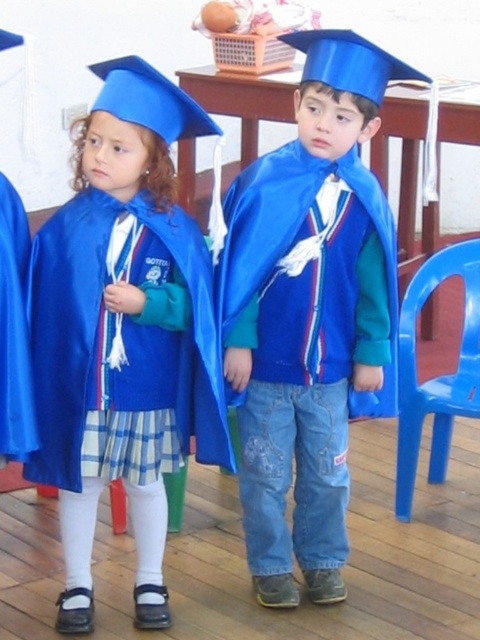
Question: Estimate the real-world distances between objects in this image. Which object is farther from the blue plastic chair at lower right?

Choices:
 (A) shiny blue graduation gown at center
 (B) matte blue graduation gown at center

Answer: (B)

Question: Where is matte blue graduation gown at center located in relation to blue plastic chair at lower right in the image?

Choices:
 (A) above
 (B) below

Answer: (A)

Question: Which point appears closest to the camera in this image?

Choices:
 (A) (336, 42)
 (B) (113, 156)
 (C) (470, 314)

Answer: (B)

Question: Does shiny blue graduation gown at center appear on the left side of blue plastic chair at lower right?

Choices:
 (A) yes
 (B) no

Answer: (A)

Question: Can you confirm if shiny blue graduation gown at center is smaller than matte blue graduation gown at center?

Choices:
 (A) no
 (B) yes

Answer: (A)

Question: Among these points, which one is farthest from the camera?

Choices:
 (A) (97, 317)
 (B) (410, 483)

Answer: (B)